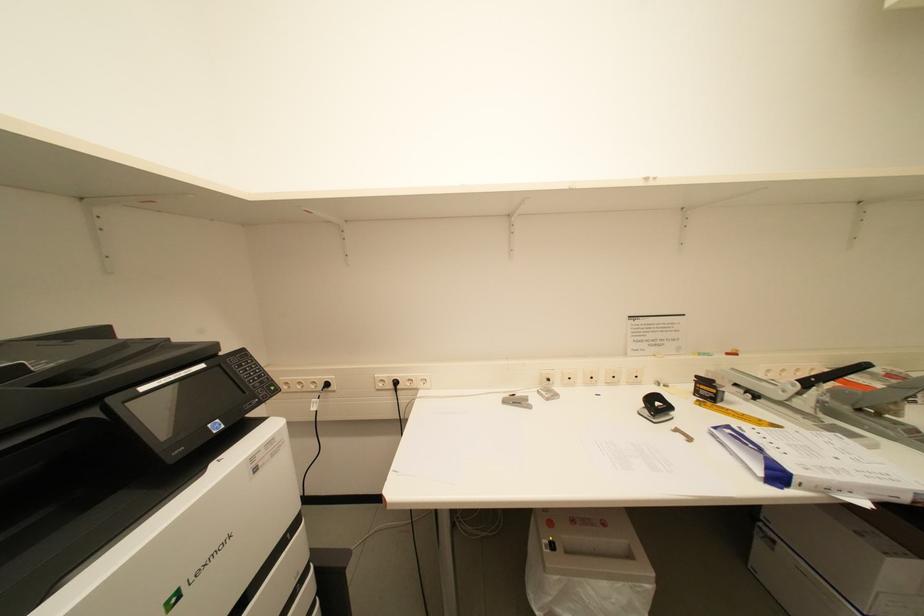
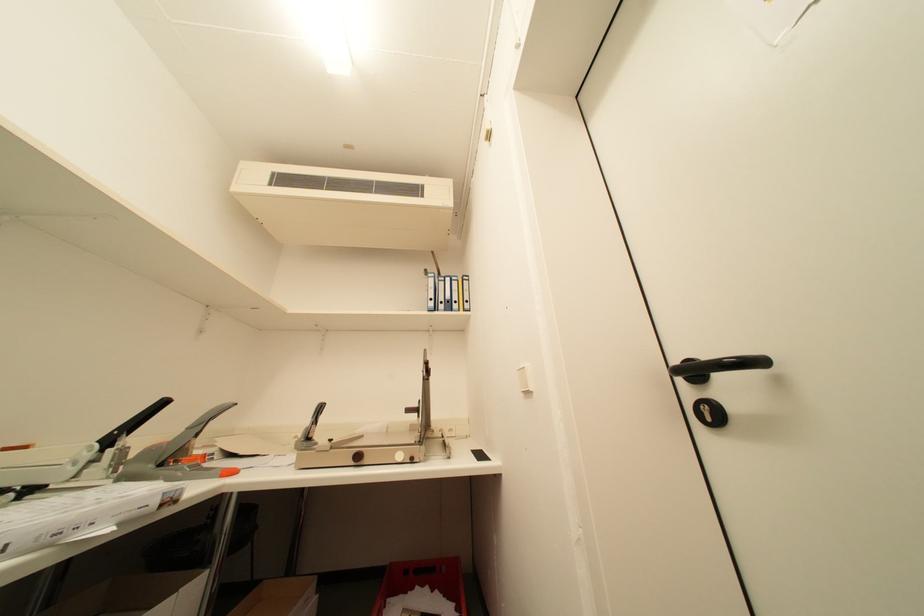
The first image is from the beginning of the video and the second image is from the end. How did the camera likely rotate when shooting the video?

The rotation direction of the camera is right-up.